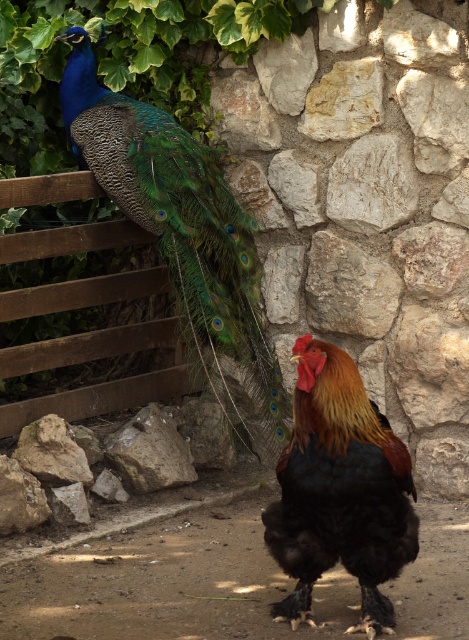
Question: Where is black glossy rooster at center located in relation to brown rough rock at center in the image?

Choices:
 (A) above
 (B) below

Answer: (B)

Question: Is shiny blue peacock at upper left to the right of brown rough rock at center from the viewer's perspective?

Choices:
 (A) yes
 (B) no

Answer: (A)

Question: Among these points, which one is nearest to the camera?

Choices:
 (A) (183, 474)
 (B) (120, 168)

Answer: (B)

Question: Which object appears farthest from the camera in this image?

Choices:
 (A) shiny blue peacock at upper left
 (B) brown rough rock at center

Answer: (B)

Question: Which is farther from the shiny blue peacock at upper left?

Choices:
 (A) brown rough rock at center
 (B) black glossy rooster at center

Answer: (B)

Question: Can you confirm if shiny blue peacock at upper left is wider than brown rough rock at center?

Choices:
 (A) no
 (B) yes

Answer: (B)